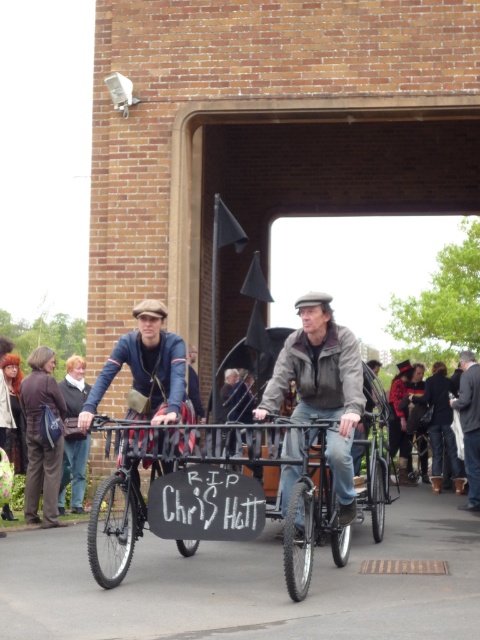
At what (x,y) coordinates should I click in order to perform the action: click on black matte bicycle at center. Please return your answer as a coordinate pair (x, y). Looking at the image, I should click on (129, 497).

Is point (143, 419) farther from camera compared to point (156, 403)?

No, it is not.

Does point (188, 548) come behind point (148, 320)?

Yes, point (188, 548) is farther from viewer.

The width and height of the screenshot is (480, 640). Identify the location of black matte bicycle at center. (129, 497).

Who is positioned more to the right, leather jacket at center or black matte bicycle at center?

Positioned to the right is leather jacket at center.

Which of these two, leather jacket at center or black matte bicycle at center, stands taller?

With more height is leather jacket at center.

What do you see at coordinates (322, 387) in the screenshot? I see `leather jacket at center` at bounding box center [322, 387].

Identify the location of leather jacket at center. This screenshot has height=640, width=480. (322, 387).

Which is above, leather jacket at center or wooden coach at center?

Positioned higher is leather jacket at center.

In the scene shown: Between leather jacket at center and wooden coach at center, which one appears on the right side from the viewer's perspective?

From the viewer's perspective, wooden coach at center appears more on the right side.

Does point (357, 355) come closer to viewer compared to point (467, 394)?

Yes, it is in front of point (467, 394).

Identify the location of leather jacket at center. coord(322,387).